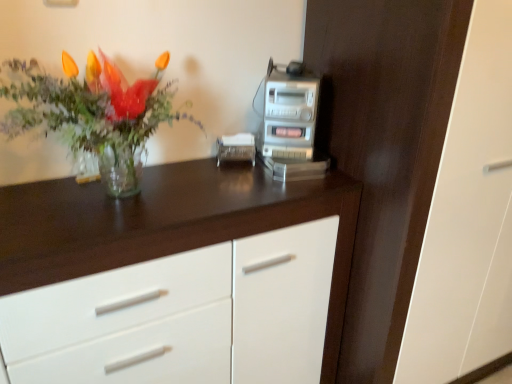
Identify the location of free spot below transparent glass vase at left (from a real-world perspective). (106, 196).